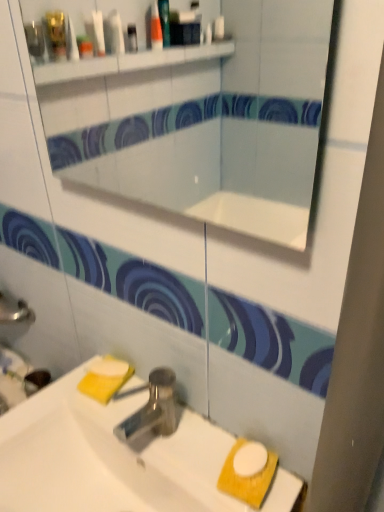
Question: Should I look upward or downward to see white glossy sink at lower center?

Choices:
 (A) down
 (B) up

Answer: (A)

Question: Could you tell me if white glossy mirror at upper center is facing white matte soap at lower center?

Choices:
 (A) no
 (B) yes

Answer: (A)

Question: Is white matte soap at lower center a part of white glossy mirror at upper center?

Choices:
 (A) yes
 (B) no

Answer: (B)

Question: Is white glossy mirror at upper center at the left side of white matte soap at lower center?

Choices:
 (A) yes
 (B) no

Answer: (B)

Question: Considering the relative positions of white glossy mirror at upper center and white matte soap at lower center in the image provided, is white glossy mirror at upper center behind white matte soap at lower center?

Choices:
 (A) no
 (B) yes

Answer: (A)

Question: From a real-world perspective, is white glossy mirror at upper center on white matte soap at lower center?

Choices:
 (A) no
 (B) yes

Answer: (B)

Question: Does white glossy mirror at upper center have a lesser height compared to white matte soap at lower center?

Choices:
 (A) no
 (B) yes

Answer: (A)

Question: Is white matte soap at lower center not inside white glossy sink at lower center?

Choices:
 (A) yes
 (B) no

Answer: (A)

Question: Does white matte soap at lower center have a smaller size compared to white glossy sink at lower center?

Choices:
 (A) yes
 (B) no

Answer: (A)

Question: Is white glossy sink at lower center at the back of white matte soap at lower center?

Choices:
 (A) no
 (B) yes

Answer: (A)

Question: Is white matte soap at lower center thinner than white glossy sink at lower center?

Choices:
 (A) no
 (B) yes

Answer: (B)

Question: Is white matte soap at lower center to the right of white glossy sink at lower center from the viewer's perspective?

Choices:
 (A) no
 (B) yes

Answer: (A)

Question: From the image's perspective, is white matte soap at lower center on top of white glossy sink at lower center?

Choices:
 (A) no
 (B) yes

Answer: (B)

Question: Is white glossy sink at lower center bigger than polished metallic tap at center?

Choices:
 (A) no
 (B) yes

Answer: (B)